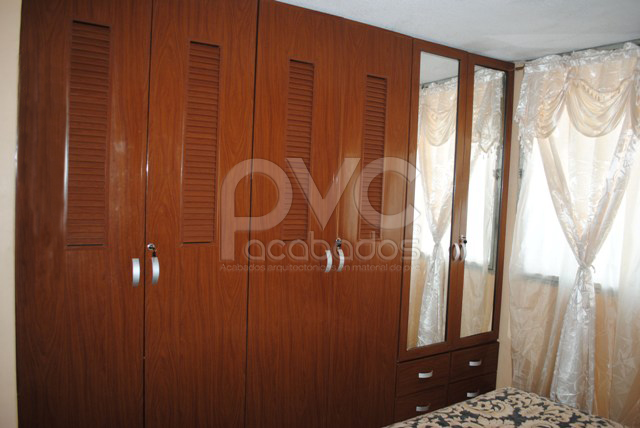
The height and width of the screenshot is (428, 640). I want to click on white curtains, so click(579, 336).